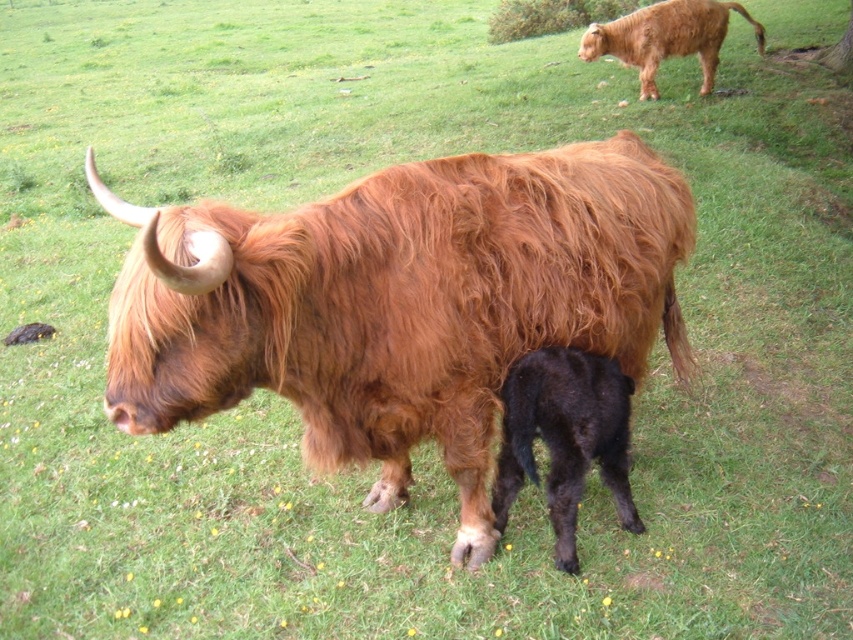
You are a farmer checking on your animals in the field. You notice the black fuzzy calf at lower center and the brown shaggy yak at upper right. Which animal is located closer to the ground?

The black fuzzy calf at lower center is positioned under the brown shaggy yak at upper right, meaning it is closer to the ground.

You are standing at a point 8.85 feet away from the Highland cow and its calf. You want to take a photo of them using a camera with a 50mm lens. Considering the cow and calf are at point [520,440], will the 50mm lens allow you to capture both the Highland cow and the calf in the frame?

The point [520,440] is 8.85 feet away from the viewer. A 50mm lens typically has a field of view wide enough to capture subjects at this distance, so yes, the 50mm lens should allow you to capture both the Highland cow and the calf in the frame.

You are a farmer checking on your herd. You notice two yaks in the field. One is the shaggy brown yak at center and the other is the brown shaggy yak at upper right. Which yak do you need to approach with extra caution due to its height?

The shaggy brown yak at center is much taller than the brown shaggy yak at upper right, so you should approach the shaggy brown yak at center with extra caution due to its greater height.